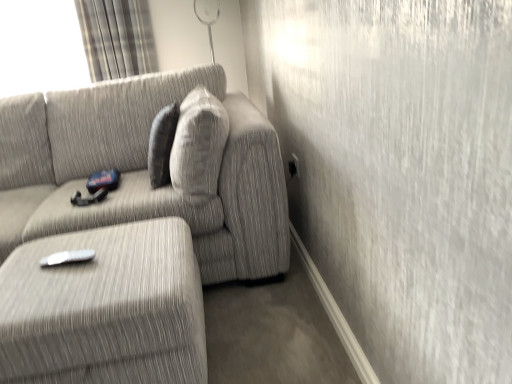
What do you see at coordinates (105, 309) in the screenshot? The image size is (512, 384). I see `textured gray ottoman at lower left` at bounding box center [105, 309].

Find the location of a particular element. white plastic remote at lower left is located at coordinates (67, 258).

What is the approximate height of plaid fabric curtain at upper left?

plaid fabric curtain at upper left is 20.86 inches in height.

The height and width of the screenshot is (384, 512). I want to click on textured gray ottoman at lower left, so click(x=105, y=309).

From the image's perspective, between textured gray couch at center and white plastic remote at lower left, which one is located above?

textured gray couch at center.

Does textured gray couch at center have a larger size compared to white plastic remote at lower left?

Indeed, textured gray couch at center has a larger size compared to white plastic remote at lower left.

Is textured gray couch at center at the left side of white plastic remote at lower left?

Yes, textured gray couch at center is to the left of white plastic remote at lower left.

Is white plastic remote at lower left at the back of textured gray couch at center?

Correct, textured gray couch at center is looking away from white plastic remote at lower left.

Can you confirm if white plastic remote at lower left is positioned to the left of textured gray ottoman at lower left?

Yes.

You are a GUI agent. You are given a task and a screenshot of the screen. Output one action in this format:
    pyautogui.click(x=<x>, y=<y>)
    Task: Click on the remote above the textured gray ottoman at lower left (from a real-world perspective)
    The height and width of the screenshot is (384, 512).
    Given the screenshot: What is the action you would take?
    pyautogui.click(x=67, y=258)

Is white plastic remote at lower left spatially inside textured gray ottoman at lower left, or outside of it?

white plastic remote at lower left is located beyond the bounds of textured gray ottoman at lower left.

From a real-world perspective, is white plastic remote at lower left located beneath textured gray ottoman at lower left?

No, from a real-world perspective, white plastic remote at lower left is not beneath textured gray ottoman at lower left.

How many degrees apart are the facing directions of textured gray ottoman at lower left and plaid fabric curtain at upper left?

The angle between the facing direction of textured gray ottoman at lower left and the facing direction of plaid fabric curtain at upper left is 3.15 degrees.

Is textured gray ottoman at lower left looking in the opposite direction of plaid fabric curtain at upper left?

That's not correct — textured gray ottoman at lower left is not looking away from plaid fabric curtain at upper left.

Is the position of textured gray ottoman at lower left more distant than that of plaid fabric curtain at upper left?

No, the depth of textured gray ottoman at lower left is less than that of plaid fabric curtain at upper left.

Consider the image. From the image's perspective, is textured gray ottoman at lower left above plaid fabric curtain at upper left?

No.

Considering the positions of objects white plastic remote at lower left and textured gray couch at center in the image provided, who is in front, white plastic remote at lower left or textured gray couch at center?

white plastic remote at lower left.

From a real-world perspective, does white plastic remote at lower left stand above textured gray couch at center?

No, from a real-world perspective, white plastic remote at lower left is not over textured gray couch at center

Is white plastic remote at lower left taller or shorter than textured gray couch at center?

white plastic remote at lower left is shorter than textured gray couch at center.

From the image's perspective, is white plastic remote at lower left above textured gray couch at center?

No, from the image's perspective, white plastic remote at lower left is not over textured gray couch at center.

In the scene shown: Is plaid fabric curtain at upper left looking in the opposite direction of textured gray ottoman at lower left?

plaid fabric curtain at upper left does not have its back to textured gray ottoman at lower left.

Considering the relative positions of plaid fabric curtain at upper left and textured gray ottoman at lower left in the image provided, is plaid fabric curtain at upper left to the left of textured gray ottoman at lower left from the viewer's perspective?

Correct, you'll find plaid fabric curtain at upper left to the left of textured gray ottoman at lower left.

Can you confirm if plaid fabric curtain at upper left is wider than textured gray ottoman at lower left?

In fact, plaid fabric curtain at upper left might be narrower than textured gray ottoman at lower left.

Which is nearer, [142,34] or [87,327]?

Clearly, point [142,34] is more distant from the camera than point [87,327].

Does plaid fabric curtain at upper left have a lesser height compared to textured gray couch at center?

Indeed, plaid fabric curtain at upper left has a lesser height compared to textured gray couch at center.

Considering the relative sizes of plaid fabric curtain at upper left and textured gray couch at center in the image provided, is plaid fabric curtain at upper left wider than textured gray couch at center?

In fact, plaid fabric curtain at upper left might be narrower than textured gray couch at center.

From the image's perspective, relative to textured gray couch at center, is plaid fabric curtain at upper left above or below?

From the image's perspective, plaid fabric curtain at upper left appears above textured gray couch at center.

This screenshot has width=512, height=384. Identify the location of curtain above the textured gray couch at center (from the image's perspective). (117, 38).

From the image's perspective, is textured gray couch at center beneath plaid fabric curtain at upper left?

Indeed, from the image's perspective, textured gray couch at center is shown beneath plaid fabric curtain at upper left.

From a real-world perspective, is textured gray couch at center physically above plaid fabric curtain at upper left?

Incorrect, from a real-world perspective, textured gray couch at center is lower than plaid fabric curtain at upper left.

Is textured gray couch at center facing away from plaid fabric curtain at upper left?

That's right, textured gray couch at center is facing away from plaid fabric curtain at upper left.

Where is `remote that is on the right side of textured gray couch at center`? Image resolution: width=512 pixels, height=384 pixels. remote that is on the right side of textured gray couch at center is located at coordinates (67, 258).

Image resolution: width=512 pixels, height=384 pixels. I want to click on remote positioned vertically above the textured gray ottoman at lower left (from a real-world perspective), so click(x=67, y=258).

Looking at this image, based on their spatial positions, is white plastic remote at lower left or textured gray couch at center closer to plaid fabric curtain at upper left?

textured gray couch at center is closer to plaid fabric curtain at upper left.

Based on their spatial positions, is plaid fabric curtain at upper left or textured gray ottoman at lower left further from white plastic remote at lower left?

plaid fabric curtain at upper left is positioned further to the anchor white plastic remote at lower left.

Estimate the real-world distances between objects in this image. Which object is closer to plaid fabric curtain at upper left, textured gray ottoman at lower left or white plastic remote at lower left?

Among the two, textured gray ottoman at lower left is located nearer to plaid fabric curtain at upper left.

Looking at the image, which one is located closer to textured gray ottoman at lower left, white plastic remote at lower left or plaid fabric curtain at upper left?

Based on the image, white plastic remote at lower left appears to be nearer to textured gray ottoman at lower left.

Considering their positions, is white plastic remote at lower left positioned closer to textured gray couch at center than plaid fabric curtain at upper left?

The object closer to textured gray couch at center is white plastic remote at lower left.

Considering their positions, is plaid fabric curtain at upper left positioned further to textured gray couch at center than white plastic remote at lower left?

plaid fabric curtain at upper left is positioned further to the anchor textured gray couch at center.

Estimate the real-world distances between objects in this image. Which object is closer to textured gray couch at center, textured gray ottoman at lower left or plaid fabric curtain at upper left?

textured gray ottoman at lower left is closer to textured gray couch at center.

Estimate the real-world distances between objects in this image. Which object is further from plaid fabric curtain at upper left, textured gray couch at center or textured gray ottoman at lower left?

textured gray ottoman at lower left.

The width and height of the screenshot is (512, 384). I want to click on studio couch located between textured gray ottoman at lower left and plaid fabric curtain at upper left in the depth direction, so click(142, 171).

This screenshot has width=512, height=384. I want to click on studio couch located between white plastic remote at lower left and plaid fabric curtain at upper left in the depth direction, so click(x=142, y=171).

At what (x,y) coordinates should I click in order to perform the action: click on remote between textured gray ottoman at lower left and plaid fabric curtain at upper left from front to back. Please return your answer as a coordinate pair (x, y). Looking at the image, I should click on (67, 258).

Where is `remote between textured gray couch at center and textured gray ottoman at lower left vertically`? The width and height of the screenshot is (512, 384). remote between textured gray couch at center and textured gray ottoman at lower left vertically is located at coordinates (67, 258).